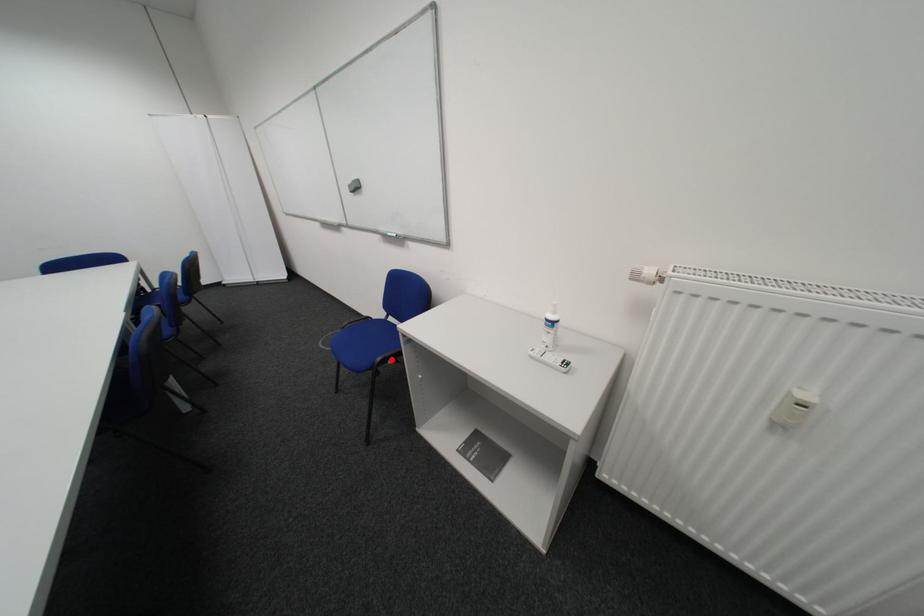
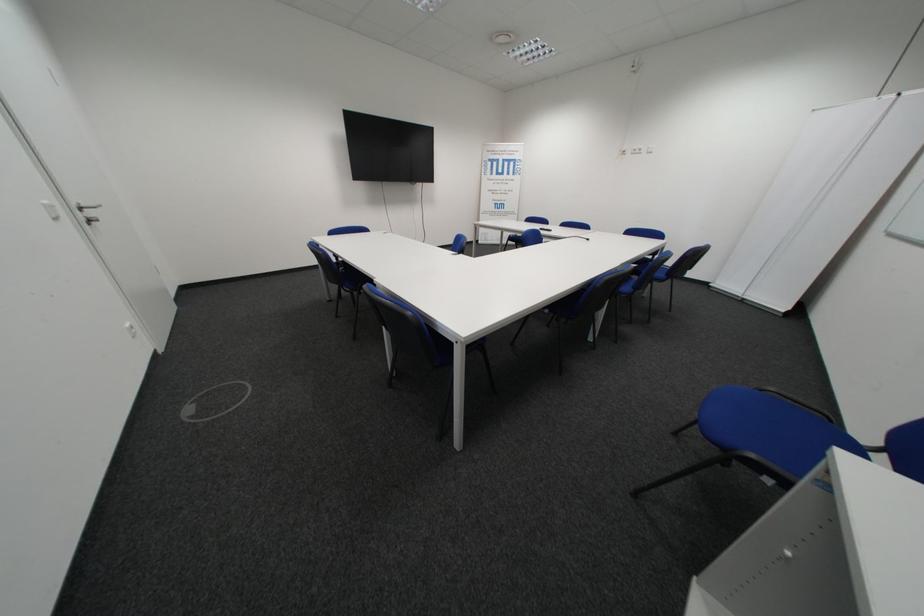
The point at the highlighted location is marked in the first image. Where is the corresponding point in the second image?

(761, 456)